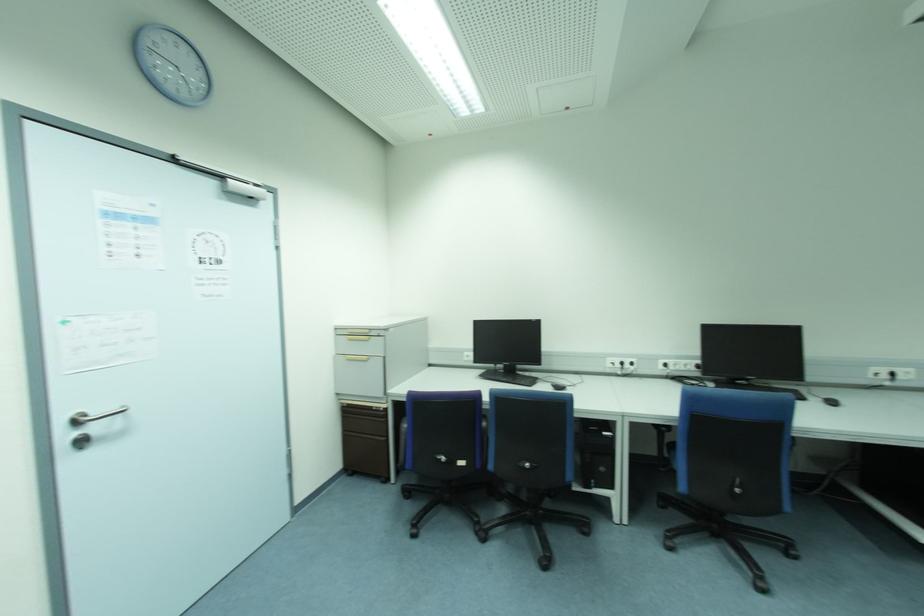
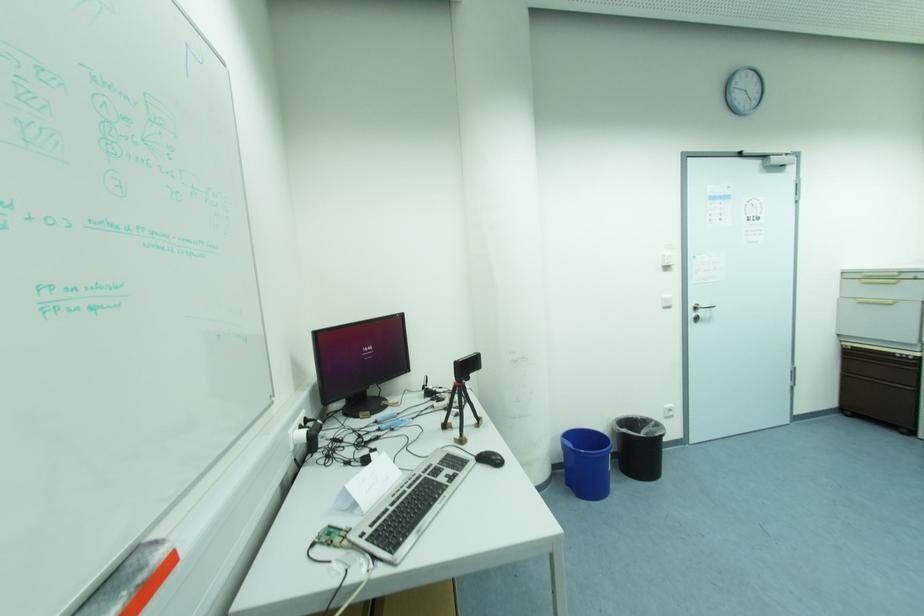
In the second image, find the point that corresponds to point (375, 408) in the first image.

(898, 355)